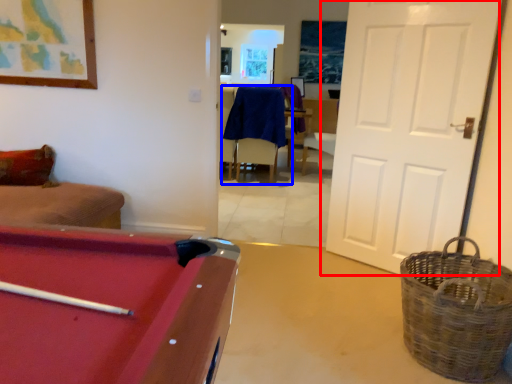
Question: Among these objects, which one is farthest to the camera, door (highlighted by a red box) or chair (highlighted by a blue box)?

Choices:
 (A) door
 (B) chair

Answer: (B)